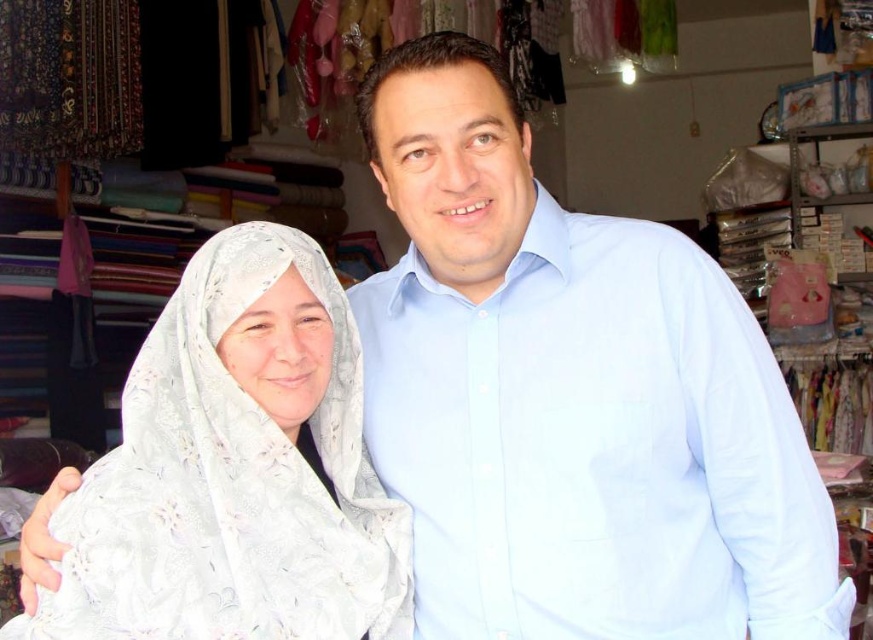
Is light blue cotton shirt at center below white lace headscarf at left?

Actually, light blue cotton shirt at center is above white lace headscarf at left.

Can you confirm if light blue cotton shirt at center is taller than white lace headscarf at left?

Yes, light blue cotton shirt at center is taller than white lace headscarf at left.

This screenshot has height=640, width=873. Find the location of `light blue cotton shirt at center`. light blue cotton shirt at center is located at coordinates (595, 445).

You are a GUI agent. You are given a task and a screenshot of the screen. Output one action in this format:
    pyautogui.click(x=<x>, y=<y>)
    Task: Click on the light blue cotton shirt at center
    This screenshot has height=640, width=873.
    Given the screenshot: What is the action you would take?
    pyautogui.click(x=595, y=445)